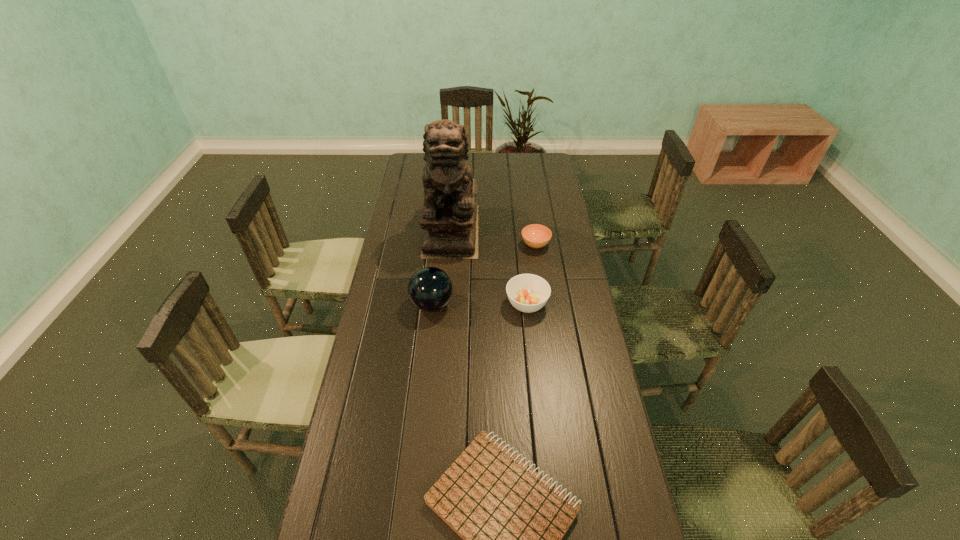
I want to click on sculpture located at the left edge, so click(449, 218).

You are a GUI agent. You are given a task and a screenshot of the screen. Output one action in this format:
    pyautogui.click(x=<x>, y=<y>)
    Task: Click on the bowling ball that is at the left edge
    Image resolution: width=960 pixels, height=540 pixels.
    Given the screenshot: What is the action you would take?
    pyautogui.click(x=430, y=289)

The height and width of the screenshot is (540, 960). I want to click on vacant space at the far edge, so click(471, 167).

Locate an element on the screen. free region at the left edge is located at coordinates [x=418, y=263].

In the image, there is a desktop. At what (x,y) coordinates should I click in order to perform the action: click on vacant space at the right edge. Please return your answer as a coordinate pair (x, y). The height and width of the screenshot is (540, 960). Looking at the image, I should click on (546, 204).

Locate an element on the screen. This screenshot has width=960, height=540. vacant area at the far left corner is located at coordinates (416, 157).

The height and width of the screenshot is (540, 960). Identify the location of blank region between the sculpture and the third tallest object. (490, 267).

I want to click on free space between the sculpture and the nearer soup bowl, so click(490, 267).

This screenshot has height=540, width=960. In order to click on free space between the bowling ball and the second shortest object in this screenshot , I will do `click(484, 274)`.

Find the location of a particular element. The height and width of the screenshot is (540, 960). free spot between the bowling ball and the third shortest object is located at coordinates (479, 304).